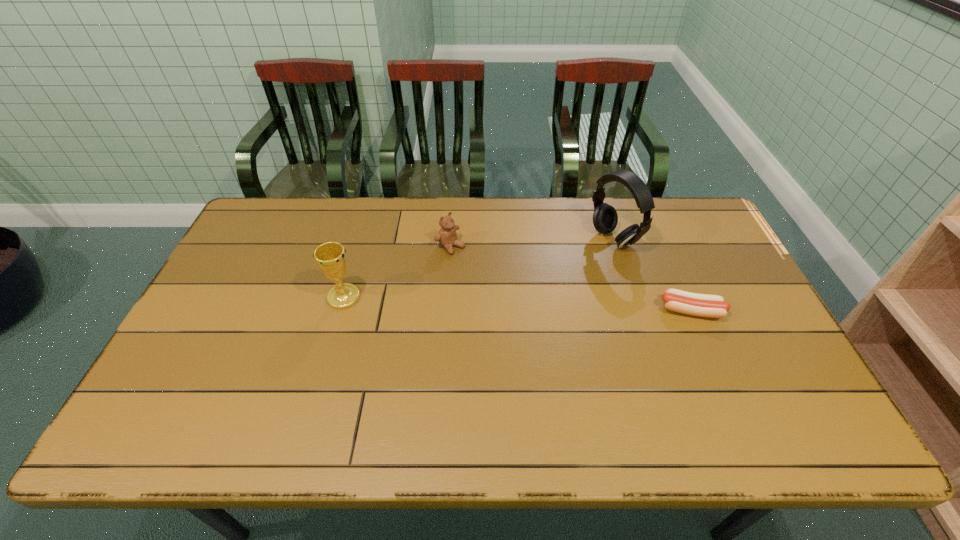
Where is `free space at the right edge`? The width and height of the screenshot is (960, 540). free space at the right edge is located at coordinates (750, 342).

The image size is (960, 540). What are the coordinates of `vacant space at the near left corner of the desktop` in the screenshot? It's located at (169, 379).

Identify the location of vacant space that's between the third tallest object and the earphone. This screenshot has height=540, width=960. (532, 242).

You are a GUI agent. You are given a task and a screenshot of the screen. Output one action in this format:
    pyautogui.click(x=<x>, y=<y>)
    Task: Click on the free spot between the sausage and the tallest object
    This screenshot has width=960, height=540.
    Given the screenshot: What is the action you would take?
    pyautogui.click(x=652, y=275)

The height and width of the screenshot is (540, 960). In order to click on vacant space in between the earphone and the teddy bear in this screenshot , I will do `click(532, 242)`.

You are a GUI agent. You are given a task and a screenshot of the screen. Output one action in this format:
    pyautogui.click(x=<x>, y=<y>)
    Task: Click on the unoccupied position between the earphone and the leftmost object
    Image resolution: width=960 pixels, height=540 pixels.
    Given the screenshot: What is the action you would take?
    pyautogui.click(x=478, y=268)

Where is `free spot between the third shortest object and the tallest object`? This screenshot has width=960, height=540. free spot between the third shortest object and the tallest object is located at coordinates (478, 268).

Identify the location of free spot between the second shortest object and the tallest object. This screenshot has width=960, height=540. (532, 242).

Locate an element on the screen. vacant point located between the sausage and the earphone is located at coordinates (652, 275).

At what (x,y) coordinates should I click in order to perform the action: click on empty space between the teddy bear and the third shortest object. Please return your answer as a coordinate pair (x, y). Image resolution: width=960 pixels, height=540 pixels. Looking at the image, I should click on (397, 272).